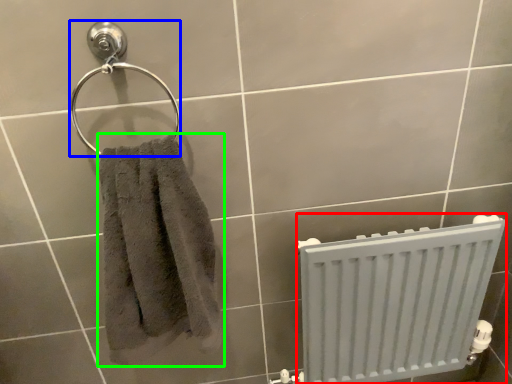
Question: Which is farther away from radiator (highlighted by a red box)? towel bar (highlighted by a blue box) or towel (highlighted by a green box)?

Choices:
 (A) towel bar
 (B) towel

Answer: (A)